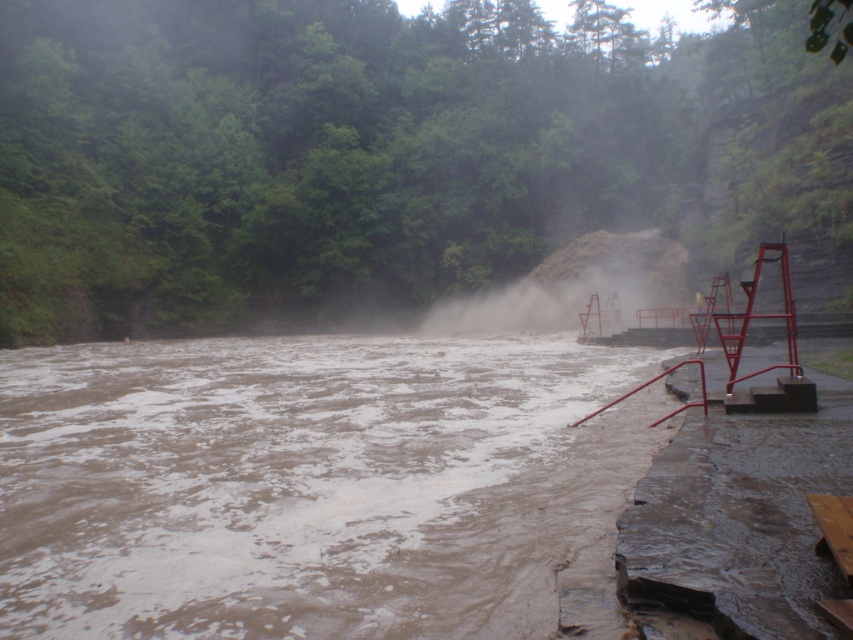
Can you confirm if muddy water at lower left is smaller than white dusty steam at center?

Correct, muddy water at lower left occupies less space than white dusty steam at center.

Can you confirm if muddy water at lower left is wider than white dusty steam at center?

No, muddy water at lower left is not wider than white dusty steam at center.

Which is in front, point (28, 454) or point (476, 298)?

Point (28, 454)

Locate an element on the screen. The width and height of the screenshot is (853, 640). muddy water at lower left is located at coordinates (309, 483).